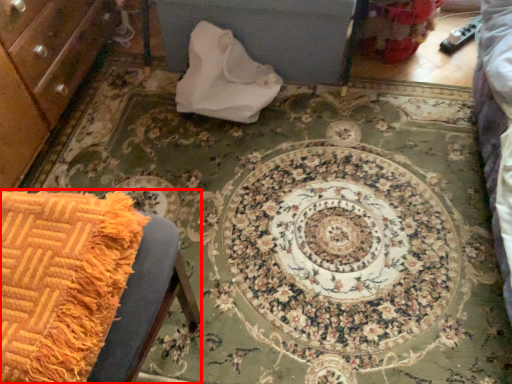
Question: From the image's perspective, where is furniture (annotated by the red box) located relative to material?

Choices:
 (A) below
 (B) above

Answer: (A)